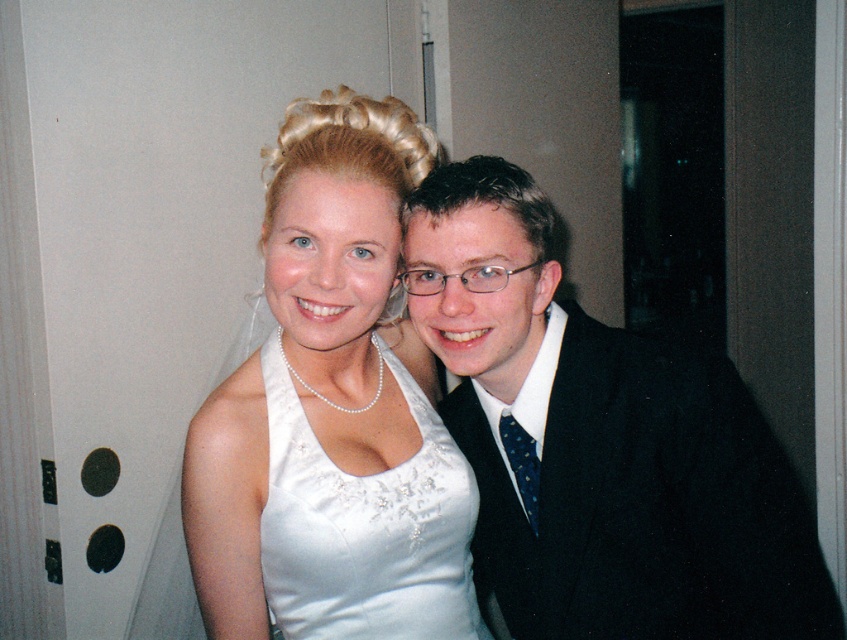
You are a photographer setting up for a group photo. You need to position the shiny black suit at right and the white satin dress at center so that both are visible in the frame. Given their sizes, which object should be placed closer to the camera to ensure both are fully visible?

The shiny black suit at right is bigger than the white satin dress at center, so placing the shiny black suit at right further back and the white satin dress at center closer to the camera will ensure both fit within the frame.

You are a photographer setting up for a group photo. You have to position the shiny black suit at right and the satin white dress at center so that both are visible in the frame. Considering their sizes, which object should be placed closer to the camera to maintain proportional visibility?

The shiny black suit at right is larger in size than the satin white dress at center. To maintain proportional visibility, the satin white dress at center should be placed closer to the camera so that both appear balanced in size within the frame.

In the image, there is a point labeled at coordinates (364, 525). Based on the scene description, which object does this point correspond to?

The point at coordinates (364, 525) corresponds to the satin white dress at center.